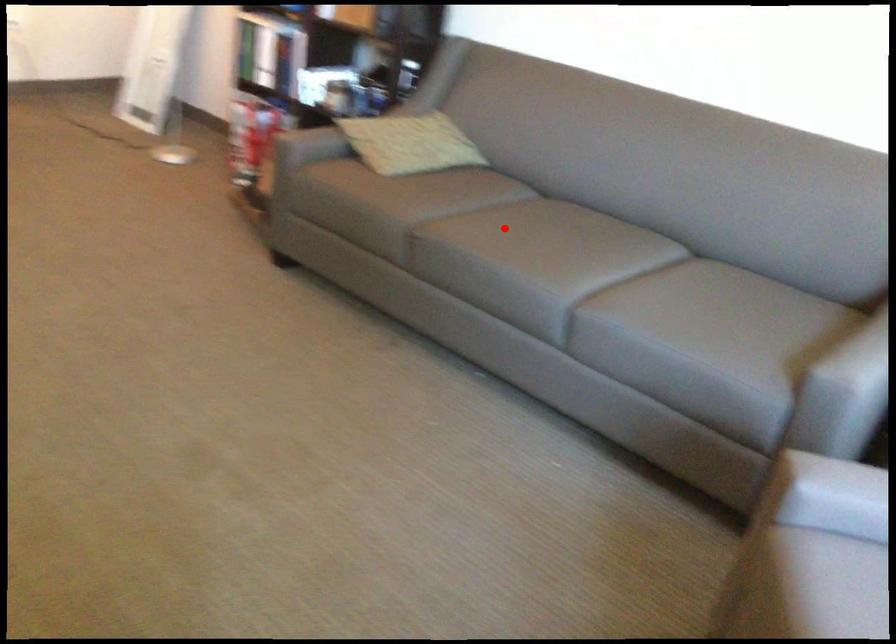
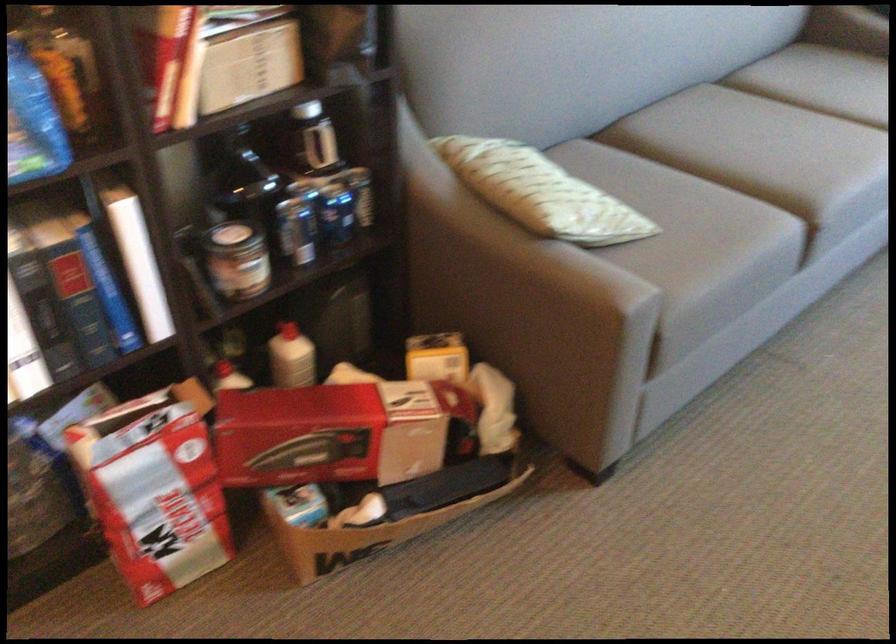
Question: I am providing you with two images of the same scene from different viewpoints. In image1, a red point is highlighted. Considering the same 3D point in image2, which of the following is correct?

Choices:
 (A) It is closer
 (B) It is farther

Answer: (A)